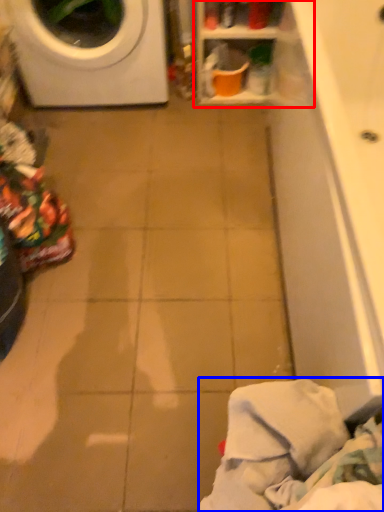
Question: Among these objects, which one is farthest to the camera, shelf (highlighted by a red box) or clothing (highlighted by a blue box)?

Choices:
 (A) shelf
 (B) clothing

Answer: (A)